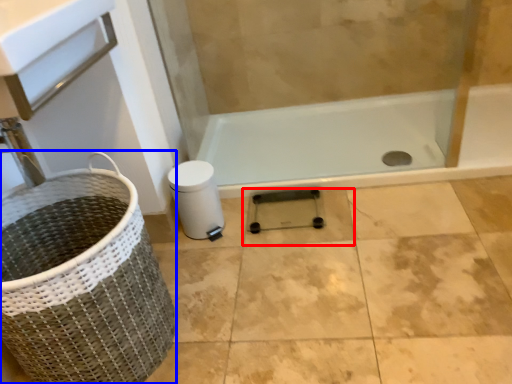
Question: Among these objects, which one is farthest to the camera, tile (highlighted by a red box) or basket container (highlighted by a blue box)?

Choices:
 (A) tile
 (B) basket container

Answer: (A)